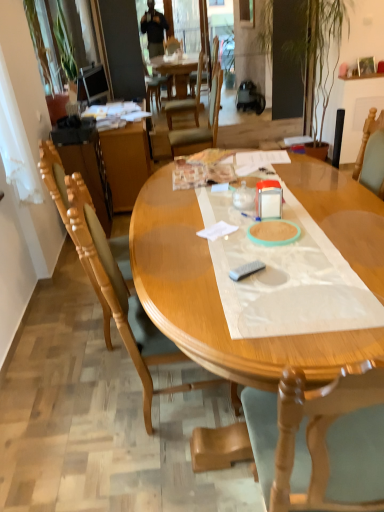
Question: Is light brown wood chair at left, marked as the 2th chair in a back-to-front arrangement, to the right of wooden desk at center from the viewer's perspective?

Choices:
 (A) no
 (B) yes

Answer: (B)

Question: Is light brown wood chair at left, the 2th chair in the front-to-back sequence, with wooden desk at center?

Choices:
 (A) yes
 (B) no

Answer: (B)

Question: From a real-world perspective, is light brown wood chair at left, marked as the 2th chair in a back-to-front arrangement, on wooden desk at center?

Choices:
 (A) yes
 (B) no

Answer: (A)

Question: Is light brown wood chair at left, the 2th chair in the front-to-back sequence, thinner than wooden desk at center?

Choices:
 (A) yes
 (B) no

Answer: (A)

Question: Considering the relative sizes of light brown wood chair at left, the 2th chair in the front-to-back sequence, and wooden desk at center in the image provided, is light brown wood chair at left, the 2th chair in the front-to-back sequence, smaller than wooden desk at center?

Choices:
 (A) yes
 (B) no

Answer: (A)

Question: Do you think transparent plastic sheet at center is within wooden chair at center, acting as the third chair starting from the front, or outside of it?

Choices:
 (A) inside
 (B) outside

Answer: (B)

Question: Is transparent plastic sheet at center taller or shorter than wooden chair at center, which is the 1th chair from back to front?

Choices:
 (A) tall
 (B) short

Answer: (B)

Question: From a real-world perspective, is transparent plastic sheet at center physically located above or below wooden chair at center, acting as the third chair starting from the front?

Choices:
 (A) below
 (B) above

Answer: (B)

Question: Is transparent plastic sheet at center bigger or smaller than wooden chair at center, acting as the third chair starting from the front?

Choices:
 (A) big
 (B) small

Answer: (B)

Question: Would you say light brown wood chair at left, marked as the 2th chair in a back-to-front arrangement, is inside or outside matte black television at upper left?

Choices:
 (A) inside
 (B) outside

Answer: (B)

Question: Looking at their shapes, would you say light brown wood chair at left, marked as the 2th chair in a back-to-front arrangement, is wider or thinner than matte black television at upper left?

Choices:
 (A) thin
 (B) wide

Answer: (B)

Question: Based on their sizes in the image, would you say light brown wood chair at left, the 2th chair in the front-to-back sequence, is bigger or smaller than matte black television at upper left?

Choices:
 (A) small
 (B) big

Answer: (B)

Question: From their relative heights in the image, would you say light brown wood chair at left, the 2th chair in the front-to-back sequence, is taller or shorter than matte black television at upper left?

Choices:
 (A) tall
 (B) short

Answer: (A)

Question: Considering their positions, is transparent plastic bottle at center located in front of or behind wooden desk at center?

Choices:
 (A) behind
 (B) front

Answer: (B)

Question: From the image's perspective, is transparent plastic bottle at center located above or below wooden desk at center?

Choices:
 (A) above
 (B) below

Answer: (B)